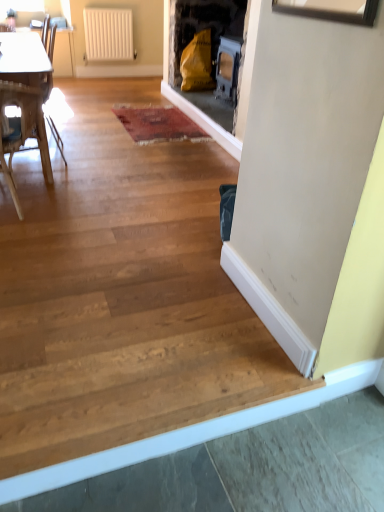
Question: Considering the relative sizes of white plastic radiator at upper center and wooden armchair at left in the image provided, is white plastic radiator at upper center wider than wooden armchair at left?

Choices:
 (A) no
 (B) yes

Answer: (A)

Question: Is white plastic radiator at upper center smaller than wooden armchair at left?

Choices:
 (A) no
 (B) yes

Answer: (B)

Question: Is the depth of white plastic radiator at upper center greater than that of wooden armchair at left?

Choices:
 (A) yes
 (B) no

Answer: (A)

Question: Does white plastic radiator at upper center have a larger size compared to wooden armchair at left?

Choices:
 (A) no
 (B) yes

Answer: (A)

Question: From a real-world perspective, is white plastic radiator at upper center over wooden armchair at left?

Choices:
 (A) yes
 (B) no

Answer: (A)

Question: From a real-world perspective, is wooden chair at left positioned above or below white plastic radiator at upper center?

Choices:
 (A) below
 (B) above

Answer: (A)

Question: Looking at the image, does wooden chair at left seem bigger or smaller compared to white plastic radiator at upper center?

Choices:
 (A) big
 (B) small

Answer: (A)

Question: Based on their positions, is wooden chair at left located to the left or right of white plastic radiator at upper center?

Choices:
 (A) right
 (B) left

Answer: (B)

Question: Is wooden chair at left inside or outside of white plastic radiator at upper center?

Choices:
 (A) inside
 (B) outside

Answer: (B)

Question: From the image's perspective, is wooden armchair at left positioned above or below white plastic radiator at upper center?

Choices:
 (A) below
 (B) above

Answer: (A)

Question: In the image, is wooden armchair at left on the left side or the right side of white plastic radiator at upper center?

Choices:
 (A) left
 (B) right

Answer: (A)

Question: Is wooden armchair at left taller or shorter than white plastic radiator at upper center?

Choices:
 (A) short
 (B) tall

Answer: (B)

Question: Is point (59, 148) closer or farther from the camera than point (109, 38)?

Choices:
 (A) closer
 (B) farther

Answer: (A)

Question: Does point (127, 13) appear closer or farther from the camera than point (52, 129)?

Choices:
 (A) closer
 (B) farther

Answer: (B)

Question: Relative to wooden armchair at left, is white plastic radiator at upper center in front or behind?

Choices:
 (A) behind
 (B) front

Answer: (A)